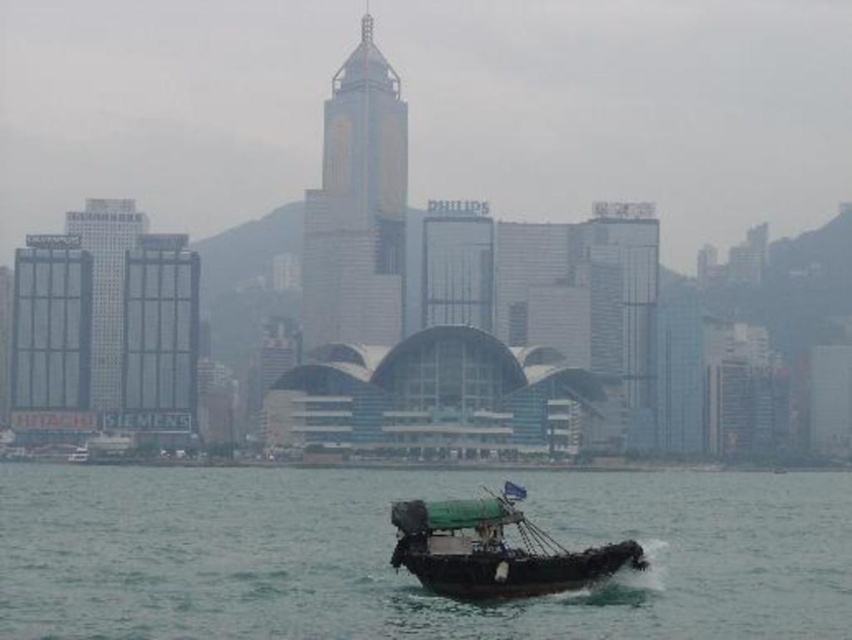
Looking at this image, can you confirm if green rubber boat at lower center is wider than green canvas boat at lower center?

Yes.

Can you confirm if green rubber boat at lower center is taller than green canvas boat at lower center?

Indeed, green rubber boat at lower center has a greater height compared to green canvas boat at lower center.

Identify the location of green rubber boat at lower center. (406, 572).